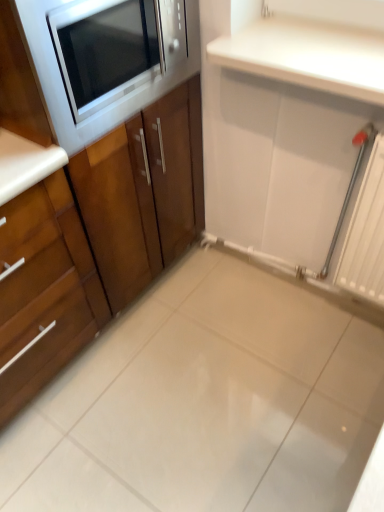
Measure the distance between wooden cabinet at left, placed as the 2th cabinetry when sorted from right to left, and camera.

wooden cabinet at left, placed as the 2th cabinetry when sorted from right to left, and camera are 1.04 meters apart.

Describe the element at coordinates (206, 403) in the screenshot. I see `white glossy ceramic tile at center` at that location.

I want to click on wooden cabinet at left, which appears as the first cabinetry when viewed from the left, so click(x=44, y=290).

Could you tell me if white glossy countertop at upper right is facing wooden cabinet at left, which appears as the first cabinetry when viewed from the left?

No, white glossy countertop at upper right is not oriented towards wooden cabinet at left, which appears as the first cabinetry when viewed from the left.

Considering the relative sizes of white glossy countertop at upper right and wooden cabinet at left, placed as the 2th cabinetry when sorted from right to left, in the image provided, is white glossy countertop at upper right shorter than wooden cabinet at left, placed as the 2th cabinetry when sorted from right to left,?

Yes, white glossy countertop at upper right is shorter than wooden cabinet at left, placed as the 2th cabinetry when sorted from right to left.

From the image's perspective, which one is positioned higher, white glossy countertop at upper right or wooden cabinet at left, placed as the 2th cabinetry when sorted from right to left?

From the image's view, white glossy countertop at upper right is above.

Is white glossy countertop at upper right to the right of wooden cabinet at left, placed as the 2th cabinetry when sorted from right to left, from the viewer's perspective?

Correct, you'll find white glossy countertop at upper right to the right of wooden cabinet at left, placed as the 2th cabinetry when sorted from right to left.

Is wooden cabinet at left, arranged as the first cabinetry when viewed from the right, a part of white glossy ceramic tile at center?

That's incorrect, wooden cabinet at left, arranged as the first cabinetry when viewed from the right, is not inside white glossy ceramic tile at center.

Is white glossy ceramic tile at center facing towards wooden cabinet at left, arranged as the first cabinetry when viewed from the right?

No, white glossy ceramic tile at center is not aimed at wooden cabinet at left, arranged as the first cabinetry when viewed from the right.

Which of these two, white glossy ceramic tile at center or wooden cabinet at left, arranged as the first cabinetry when viewed from the right, is wider?

With larger width is white glossy ceramic tile at center.

Is white glossy ceramic tile at center taller or shorter than wooden cabinet at left, the second cabinetry in the left-to-right sequence?

In the image, white glossy ceramic tile at center appears to be shorter than wooden cabinet at left, the second cabinetry in the left-to-right sequence.

Locate an element on the screen. Image resolution: width=384 pixels, height=512 pixels. microwave oven above the wooden cabinet at left, placed as the 2th cabinetry when sorted from right to left (from the image's perspective) is located at coordinates coord(115,47).

Consider the image. Considering the positions of objects matte black microwave at upper left and wooden cabinet at left, which appears as the first cabinetry when viewed from the left, in the image provided, who is more to the right, matte black microwave at upper left or wooden cabinet at left, which appears as the first cabinetry when viewed from the left,?

Positioned to the right is matte black microwave at upper left.

Consider the image. Which of these two, matte black microwave at upper left or wooden cabinet at left, placed as the 2th cabinetry when sorted from right to left, is thinner?

With smaller width is wooden cabinet at left, placed as the 2th cabinetry when sorted from right to left.

From the image's perspective, is white glossy ceramic tile at center on top of matte black microwave at upper left?

No.

Looking at this image, considering the relative sizes of white glossy ceramic tile at center and matte black microwave at upper left in the image provided, is white glossy ceramic tile at center thinner than matte black microwave at upper left?

No, white glossy ceramic tile at center is not thinner than matte black microwave at upper left.

Would you say white glossy ceramic tile at center is a long distance from matte black microwave at upper left?

Yes.

In the image, is white glossy ceramic tile at center on the left side or the right side of matte black microwave at upper left?

Clearly, white glossy ceramic tile at center is on the right of matte black microwave at upper left in the image.

From a real-world perspective, which object rests below the other?

wooden cabinet at left, the second cabinetry in the left-to-right sequence, from a real-world perspective.

Is the position of wooden cabinet at left, the second cabinetry in the left-to-right sequence, more distant than that of white glossy countertop at upper right?

No, it is in front of white glossy countertop at upper right.

Is wooden cabinet at left, the second cabinetry in the left-to-right sequence, at the right side of white glossy countertop at upper right?

No.

How far apart are matte black microwave at upper left and white glossy countertop at upper right?

The distance of matte black microwave at upper left from white glossy countertop at upper right is 14.58 inches.

Is matte black microwave at upper left wider or thinner than white glossy countertop at upper right?

Clearly, matte black microwave at upper left has more width compared to white glossy countertop at upper right.

From a real-world perspective, between matte black microwave at upper left and white glossy countertop at upper right, who is vertically higher?

matte black microwave at upper left is physically above.

Could you tell me if matte black microwave at upper left is facing white glossy countertop at upper right?

Yes, matte black microwave at upper left is turned towards white glossy countertop at upper right.

Is white glossy countertop at upper right surrounded by wooden cabinet at left, placed as the 2th cabinetry when sorted from right to left?

Definitely not — white glossy countertop at upper right is not inside wooden cabinet at left, placed as the 2th cabinetry when sorted from right to left.

In terms of width, does wooden cabinet at left, which appears as the first cabinetry when viewed from the left, look wider or thinner when compared to white glossy countertop at upper right?

Clearly, wooden cabinet at left, which appears as the first cabinetry when viewed from the left, has more width compared to white glossy countertop at upper right.

Who is bigger, wooden cabinet at left, which appears as the first cabinetry when viewed from the left, or white glossy countertop at upper right?

Bigger between the two is wooden cabinet at left, which appears as the first cabinetry when viewed from the left.

Is the position of wooden cabinet at left, placed as the 2th cabinetry when sorted from right to left, more distant than that of white glossy countertop at upper right?

No, it is not.

From a real-world perspective, count 2nd cabinetrys downward from the white glossy countertop at upper right and point to it. Please provide its 2D coordinates.

[(44, 290)]

From the image's perspective, count 2nd cabinetrys upward from the white glossy ceramic tile at center and point to it. Please provide its 2D coordinates.

[(92, 191)]

Based on the photo, considering their positions, is white glossy ceramic tile at center positioned closer to matte black microwave at upper left than wooden cabinet at left, placed as the 2th cabinetry when sorted from right to left?

Based on the image, wooden cabinet at left, placed as the 2th cabinetry when sorted from right to left, appears to be nearer to matte black microwave at upper left.

Estimate the real-world distances between objects in this image. Which object is further from wooden cabinet at left, the second cabinetry in the left-to-right sequence, matte black microwave at upper left or wooden cabinet at left, which appears as the first cabinetry when viewed from the left?

matte black microwave at upper left.

Based on their spatial positions, is matte black microwave at upper left or wooden cabinet at left, arranged as the first cabinetry when viewed from the right, closer to wooden cabinet at left, placed as the 2th cabinetry when sorted from right to left?

Based on the image, wooden cabinet at left, arranged as the first cabinetry when viewed from the right, appears to be nearer to wooden cabinet at left, placed as the 2th cabinetry when sorted from right to left.

When comparing their distances from wooden cabinet at left, which appears as the first cabinetry when viewed from the left, does white glossy countertop at upper right or matte black microwave at upper left seem further?

white glossy countertop at upper right is further to wooden cabinet at left, which appears as the first cabinetry when viewed from the left.

Looking at the image, which one is located closer to wooden cabinet at left, which appears as the first cabinetry when viewed from the left, wooden cabinet at left, arranged as the first cabinetry when viewed from the right, or white glossy ceramic tile at center?

Based on the image, wooden cabinet at left, arranged as the first cabinetry when viewed from the right, appears to be nearer to wooden cabinet at left, which appears as the first cabinetry when viewed from the left.

Which object lies nearer to the anchor point wooden cabinet at left, the second cabinetry in the left-to-right sequence, white glossy ceramic tile at center or matte black microwave at upper left?

matte black microwave at upper left.

When comparing their distances from white glossy ceramic tile at center, does white glossy countertop at upper right or wooden cabinet at left, placed as the 2th cabinetry when sorted from right to left, seem closer?

wooden cabinet at left, placed as the 2th cabinetry when sorted from right to left, is closer to white glossy ceramic tile at center.

Looking at this image, looking at the image, which one is located closer to matte black microwave at upper left, white glossy countertop at upper right or wooden cabinet at left, the second cabinetry in the left-to-right sequence?

Among the two, wooden cabinet at left, the second cabinetry in the left-to-right sequence, is located nearer to matte black microwave at upper left.

Locate an element on the screen. countertop between matte black microwave at upper left and white glossy ceramic tile at center from top to bottom is located at coordinates (312, 47).

Where is `cabinetry situated between matte black microwave at upper left and white glossy countertop at upper right from left to right`? cabinetry situated between matte black microwave at upper left and white glossy countertop at upper right from left to right is located at coordinates (92, 191).

Locate an element on the screen. The image size is (384, 512). microwave oven between wooden cabinet at left, which appears as the first cabinetry when viewed from the left, and white glossy countertop at upper right from left to right is located at coordinates (115, 47).

The width and height of the screenshot is (384, 512). In order to click on cabinetry between wooden cabinet at left, placed as the 2th cabinetry when sorted from right to left, and white glossy countertop at upper right, in the horizontal direction in this screenshot , I will do `click(92, 191)`.